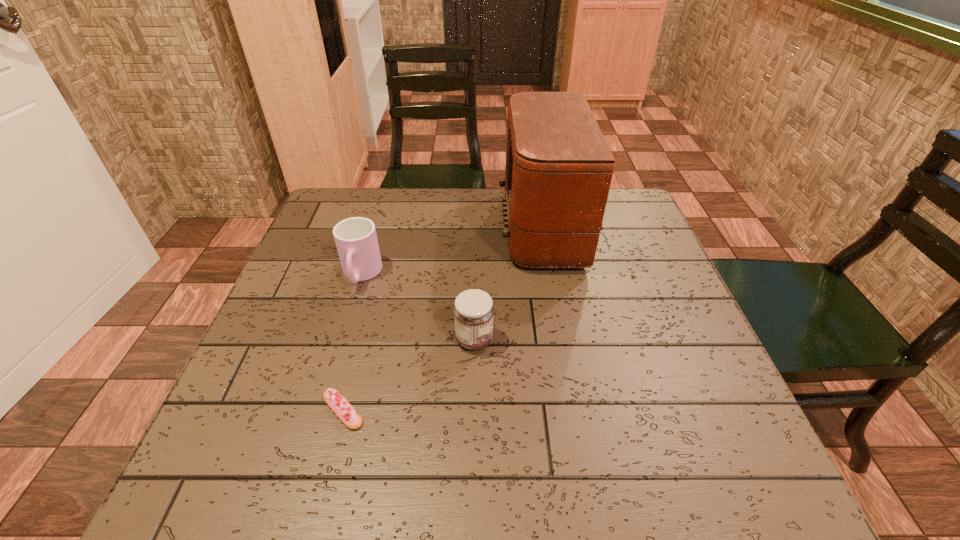
You are a GUI agent. You are given a task and a screenshot of the screen. Output one action in this format:
    pyautogui.click(x=<x>, y=<y>)
    Task: Click on the free space at the right edge
    
    Given the screenshot: What is the action you would take?
    tap(658, 306)

Locate an element on the screen. Image resolution: width=960 pixels, height=540 pixels. vacant area at the far left corner of the desktop is located at coordinates (321, 223).

Locate an element on the screen. free region at the near left corner of the desktop is located at coordinates (245, 464).

Where is `vacant region at the far right corner of the desktop`? vacant region at the far right corner of the desktop is located at coordinates (645, 229).

Where is `vacant space at the near right corner of the desktop`? The width and height of the screenshot is (960, 540). vacant space at the near right corner of the desktop is located at coordinates (751, 468).

The width and height of the screenshot is (960, 540). Find the location of `free space that is in between the cup and the shortest object`. free space that is in between the cup and the shortest object is located at coordinates (352, 342).

This screenshot has height=540, width=960. I want to click on vacant space that's between the third object from left to right and the cup, so click(x=418, y=307).

This screenshot has height=540, width=960. I want to click on vacant area that lies between the cup and the tallest object, so click(x=462, y=252).

Find the location of `vacant space that is in between the cup and the third object from left to right`. vacant space that is in between the cup and the third object from left to right is located at coordinates (418, 307).

Locate an element on the screen. empty space that is in between the third object from left to right and the shortest object is located at coordinates (409, 375).